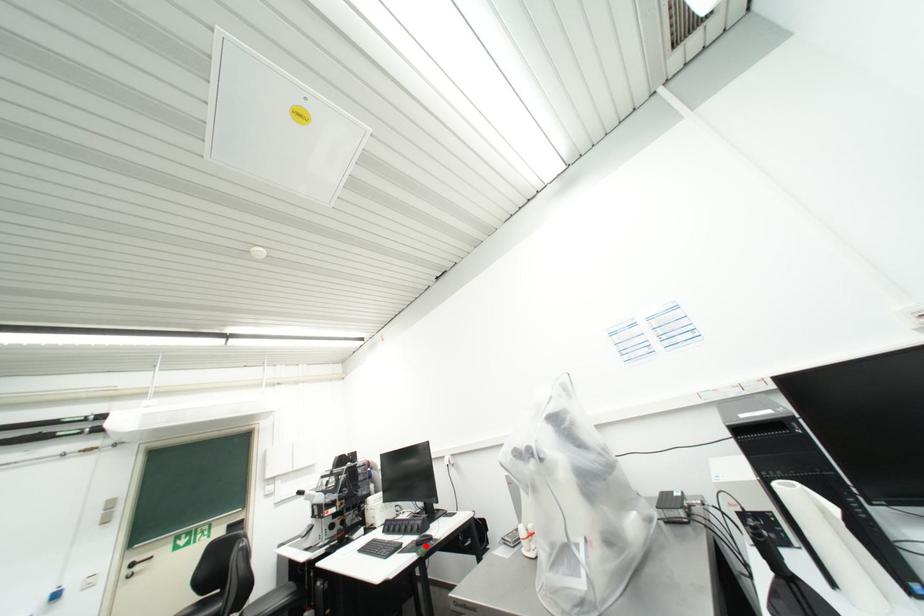
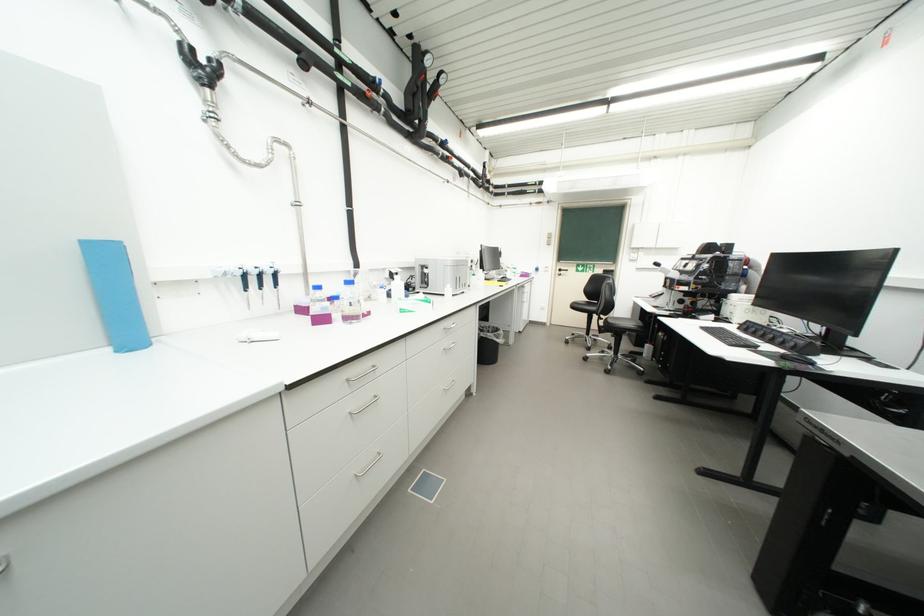
In the second image, find the point that corresponds to the highlighted location in the first image.

(792, 359)